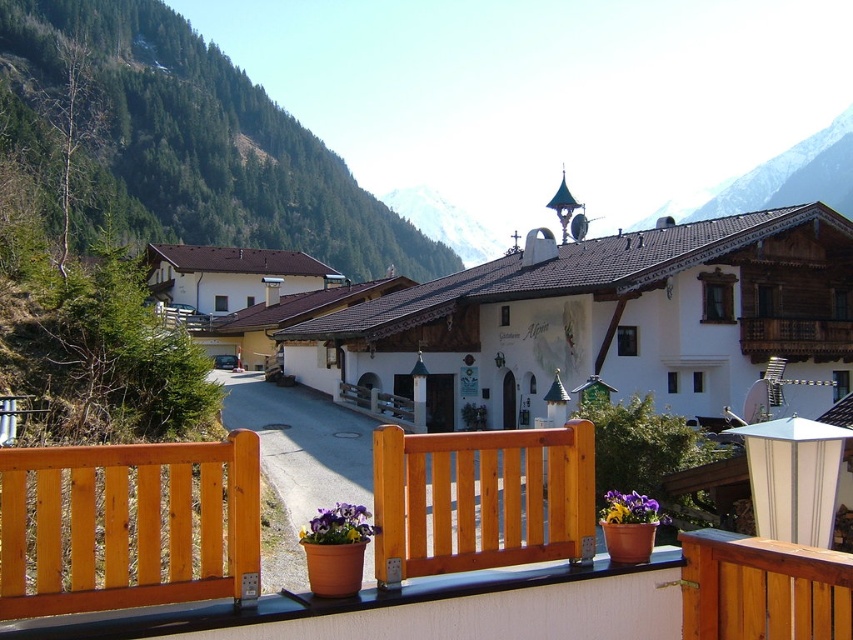
Between purple matte flower at lower center and purple matte flower pot at lower center, which one is positioned lower?

Positioned lower is purple matte flower at lower center.

Between point (300, 540) and point (602, 515), which one is positioned behind?

The point (300, 540) is behind.

Where is `purple matte flower at lower center`? purple matte flower at lower center is located at coordinates (338, 525).

Consider the image. Can you confirm if light brown wooden bench at lower left is positioned below purple matte flower at lower center?

No.

Does light brown wooden bench at lower left appear over purple matte flower at lower center?

Yes, light brown wooden bench at lower left is above purple matte flower at lower center.

Who is more forward, (109, 604) or (352, 532)?

Point (109, 604) is in front.

Identify the location of light brown wooden bench at lower left. (129, 525).

Who is positioned more to the right, light brown wooden balustrade at center or purple matte flower at lower center?

From the viewer's perspective, light brown wooden balustrade at center appears more on the right side.

Who is more forward, (480, 518) or (345, 532)?

Point (345, 532)

Where is `light brown wooden balustrade at center`? light brown wooden balustrade at center is located at coordinates (480, 499).